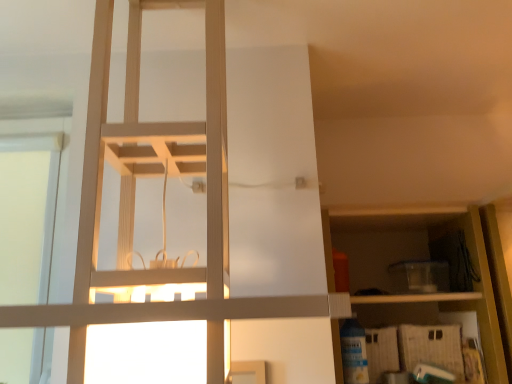
In order to face matte plastic bottle at lower right, should I rotate leftwards or rightwards?

Rotate right and turn 13.396 degrees.

Where is `matte plastic bottle at lower right`? matte plastic bottle at lower right is located at coordinates (354, 352).

Measure the distance between matte plastic bottle at lower right and camera.

Result: matte plastic bottle at lower right is 1.44 meters away from camera.

What do you see at coordinates (354, 352) in the screenshot?
I see `matte plastic bottle at lower right` at bounding box center [354, 352].

Where is `matte plastic bottle at lower right`? This screenshot has width=512, height=384. matte plastic bottle at lower right is located at coordinates (354, 352).